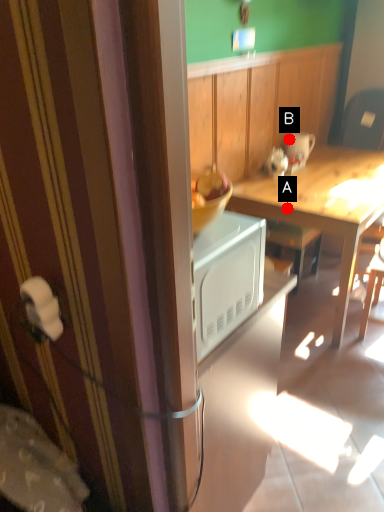
Question: Two points are circled on the image, labeled by A and B beside each circle. Which point is closer to the camera?

Choices:
 (A) A is closer
 (B) B is closer

Answer: (A)